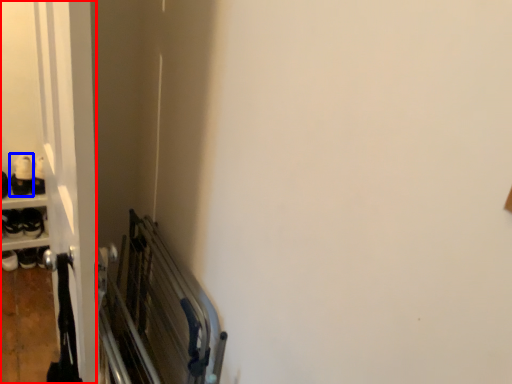
Question: Which point is further to the camera, door (highlighted by a red box) or footwear (highlighted by a blue box)?

Choices:
 (A) door
 (B) footwear

Answer: (B)